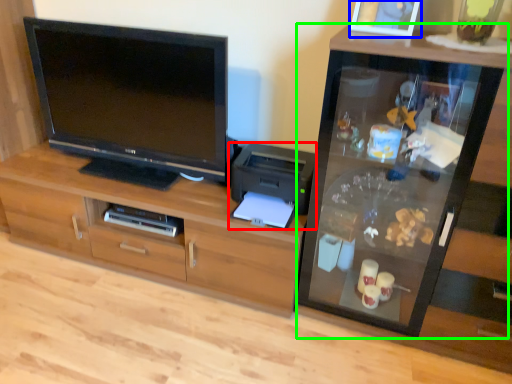
Question: Which object is positioned closest to printer (highlighted by a red box)? Select from picture frame (highlighted by a blue box) and tv cabinet (highlighted by a green box).

Choices:
 (A) picture frame
 (B) tv cabinet

Answer: (B)